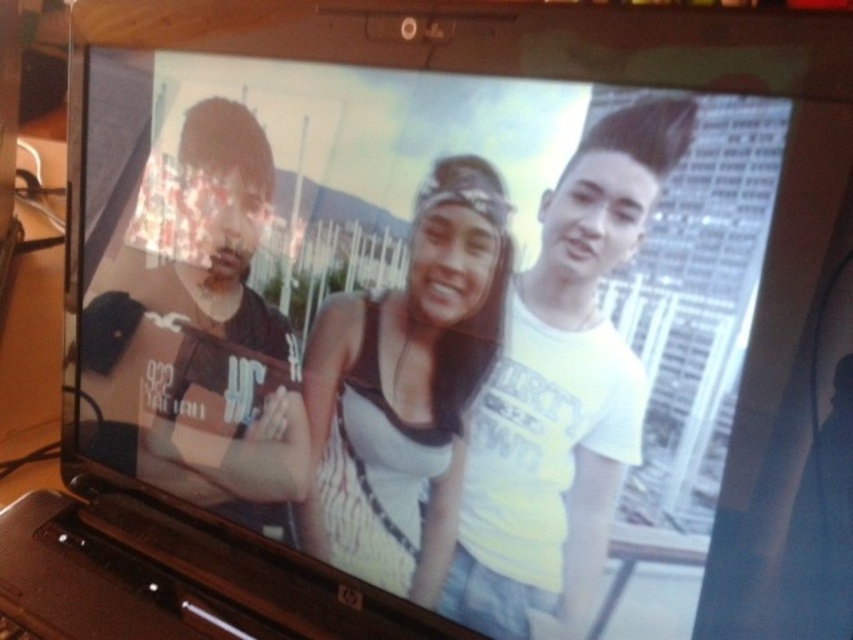
How much distance is there between white matte t-shirt at center and white matte tank top at center?

white matte t-shirt at center and white matte tank top at center are 2.01 inches apart.

Is white matte t-shirt at center positioned before white matte tank top at center?

Yes.

Who is more distant from viewer, (590, 300) or (434, 305)?

Point (434, 305)

At what (x,y) coordinates should I click in order to perform the action: click on white matte t-shirt at center. Please return your answer as a coordinate pair (x, y). Looking at the image, I should click on (561, 392).

I want to click on matte black guitar at left, so click(x=199, y=332).

Is matte black guitar at left to the left of white matte tank top at center from the viewer's perspective?

Indeed, matte black guitar at left is positioned on the left side of white matte tank top at center.

Locate an element on the screen. matte black guitar at left is located at coordinates (199, 332).

Can you confirm if white matte t-shirt at center is positioned above matte black guitar at left?

No, white matte t-shirt at center is not above matte black guitar at left.

Identify the location of white matte t-shirt at center. (561, 392).

Does point (607, 448) come closer to viewer compared to point (276, 490)?

Yes, point (607, 448) is closer to viewer.

Where is `white matte t-shirt at center`? The height and width of the screenshot is (640, 853). white matte t-shirt at center is located at coordinates (561, 392).